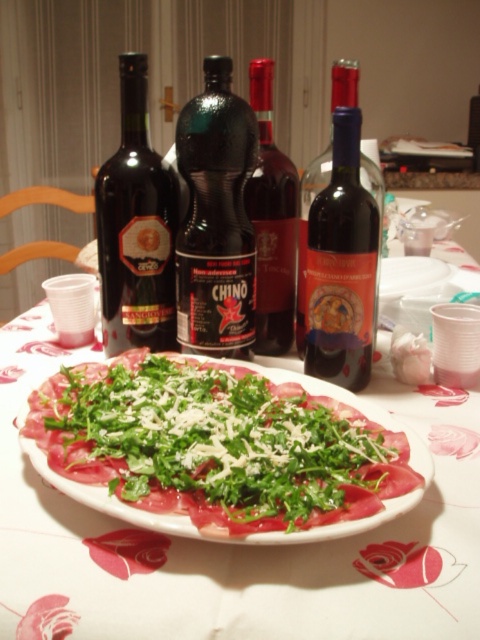
Question: Which point is farther to the camera?

Choices:
 (A) black glass bottle at center
 (B) dark glass bottle at left

Answer: (B)

Question: Which object is the farthest from the dark glass wine bottle at center?

Choices:
 (A) green leafy salad at center
 (B) green leafymaterial/texture at center

Answer: (A)

Question: Is dark glass wine bottle at center wider than dark glass bottle at center?

Choices:
 (A) yes
 (B) no

Answer: (A)

Question: Is black glass bottle at center positioned in front of dark glass wine bottle at center?

Choices:
 (A) no
 (B) yes

Answer: (A)

Question: Can you confirm if green leafymaterial/texture at center is positioned above black glass bottle at center?

Choices:
 (A) yes
 (B) no

Answer: (B)

Question: Which point is farther from the camera taking this photo?

Choices:
 (A) (123, 532)
 (B) (164, 292)

Answer: (B)